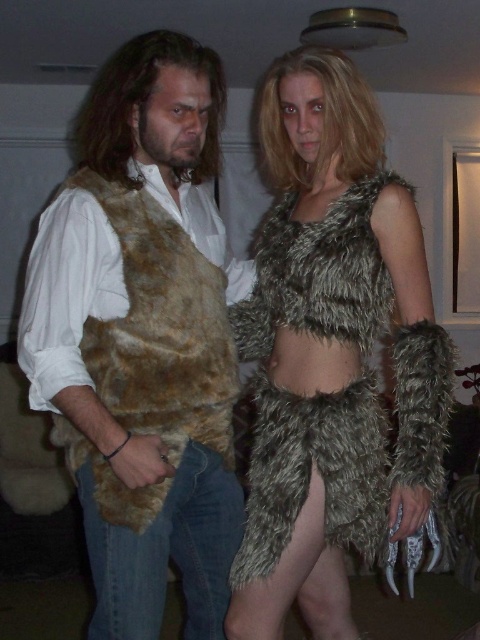
Question: Can you confirm if fuzzy brown vest at left is positioned above fuzzy fur outfit at center?

Choices:
 (A) no
 (B) yes

Answer: (B)

Question: Which object is farther from the camera taking this photo?

Choices:
 (A) fuzzy fur outfit at center
 (B) fuzzy brown vest at left

Answer: (A)

Question: Is fuzzy brown vest at left above fuzzy fur outfit at center?

Choices:
 (A) no
 (B) yes

Answer: (B)

Question: Does fuzzy brown vest at left have a greater width compared to fuzzy fur outfit at center?

Choices:
 (A) no
 (B) yes

Answer: (A)

Question: Which object is farther from the camera taking this photo?

Choices:
 (A) fuzzy brown vest at left
 (B) fuzzy fur outfit at center

Answer: (B)